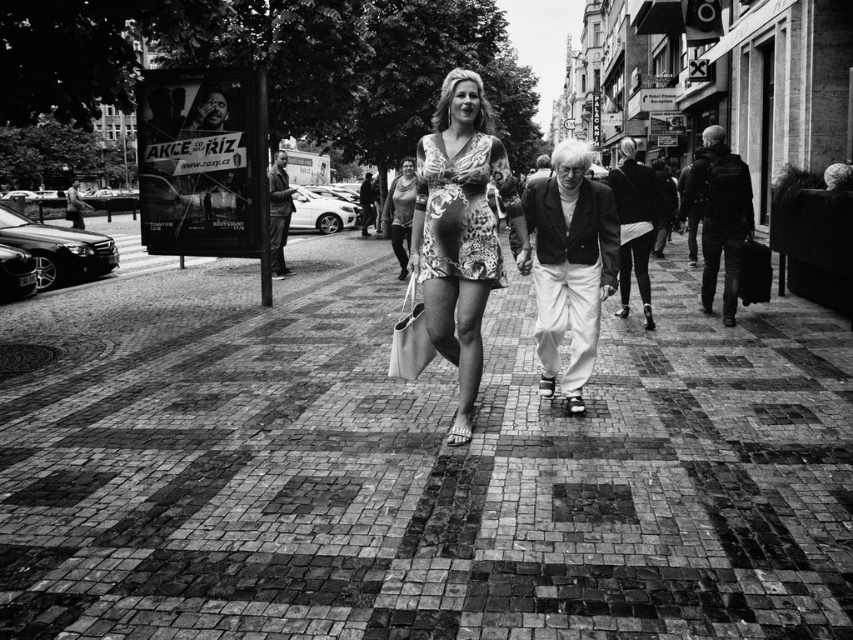
You are a delivery person who needs to place a package on the brick pavement at center. The package is 4 meters long. Can you safely place the package without it overlapping the matte beige fabric shopping bag at center?

The distance between the brick pavement at center and the matte beige fabric shopping bag at center is 3.83 meters. Since the package is 4 meters long, placing it would cause it to overlap the matte beige fabric shopping bag at center. Therefore, it is not safe to place the package there.

You are a photographer standing on the sidewalk and want to take a photo of the brick pavement at center and the matte gray tank top at center. Which object is closer to the camera?

The matte gray tank top at center is closer to the camera because the brick pavement at center is below it, indicating it is positioned lower in the frame and likely farther away.